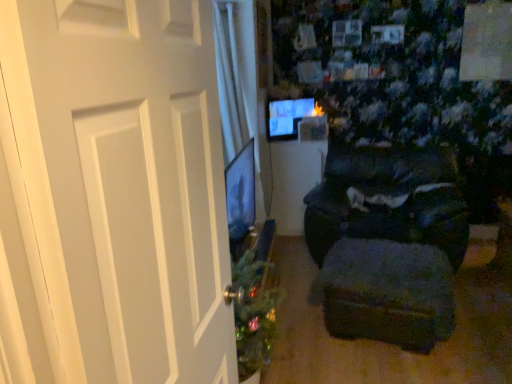
What are the coordinates of `vacant area on top of matte black monitor at upper center (from a real-world perspective)` in the screenshot? It's located at (302, 95).